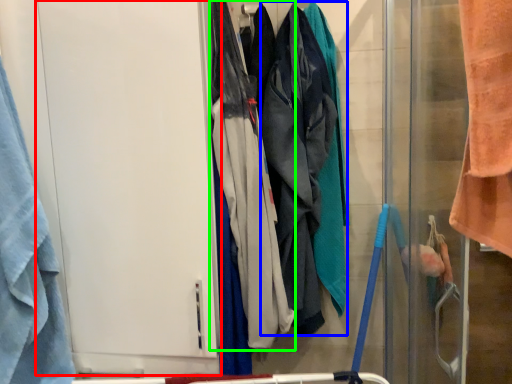
Question: Estimate the real-world distances between objects in this image. Which object is farther from screen door (highlighted by a red box), wide (highlighted by a blue box) or wide (highlighted by a green box)?

Choices:
 (A) wide
 (B) wide

Answer: (A)